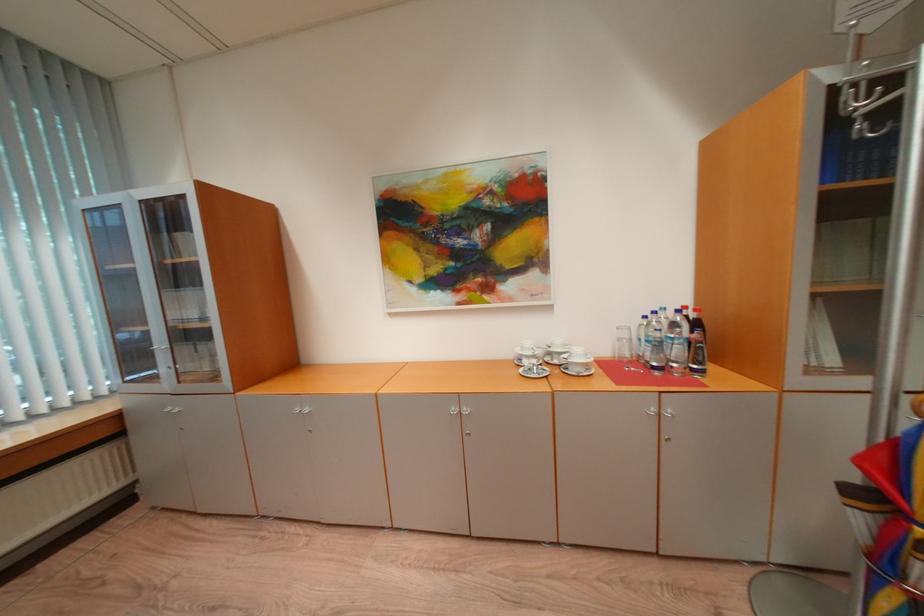
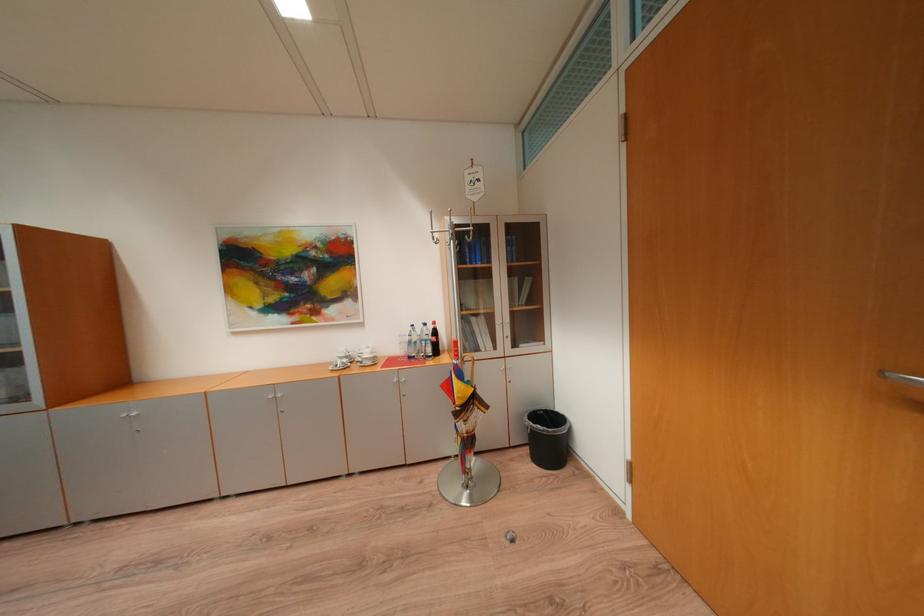
Find the pixel in the second image that matches point 663,411 in the first image.

(405, 381)